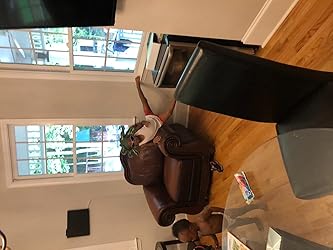
Identify the location of glass dining room table. The height and width of the screenshot is (250, 333). (293, 210).